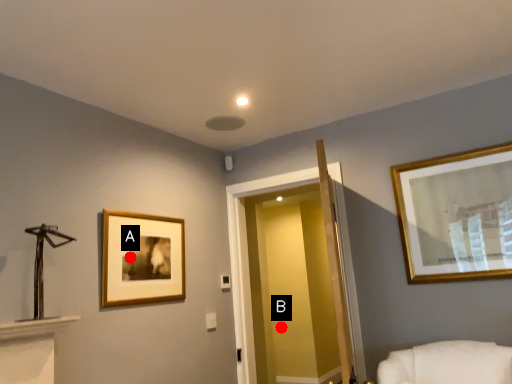
Question: Two points are circled on the image, labeled by A and B beside each circle. Which point is closer to the camera?

Choices:
 (A) A is closer
 (B) B is closer

Answer: (A)